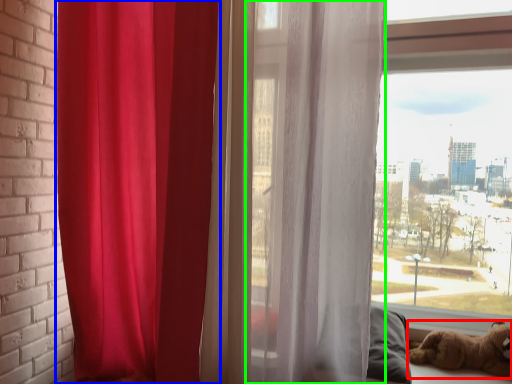
Question: Which object is the closest to the dog (highlighted by a red box)? Choose among these: curtain (highlighted by a blue box) or curtain (highlighted by a green box).

Choices:
 (A) curtain
 (B) curtain

Answer: (B)